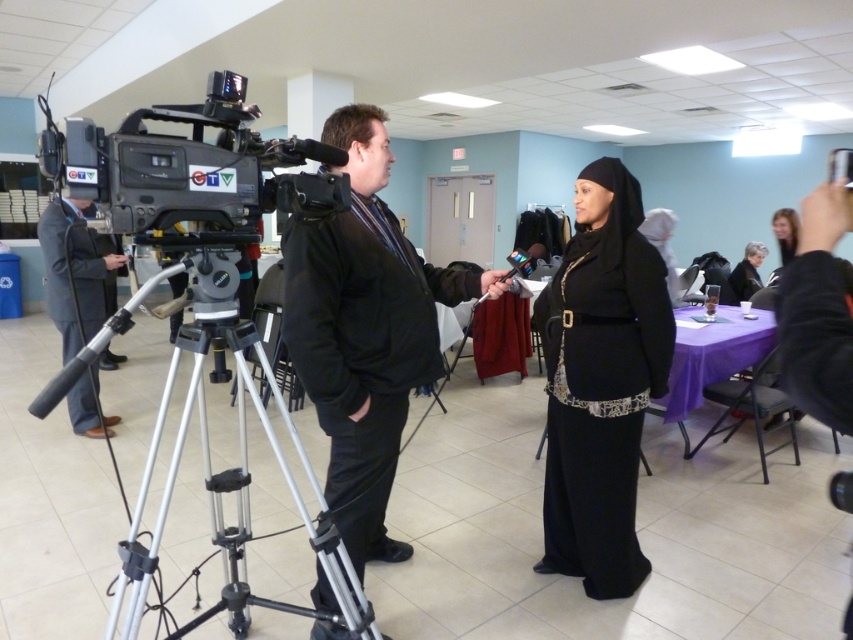
How far apart are black matte jacket at center and black velvet robe at center?

black matte jacket at center and black velvet robe at center are 4.54 meters apart from each other.

Does black matte jacket at center have a smaller size compared to black velvet robe at center?

No.

Measure the distance between point (363, 292) and camera.

Point (363, 292) and camera are 1.93 meters apart.

Identify the location of black matte jacket at center. (364, 330).

Can you confirm if black matte jacket at center is positioned above silver metallic tripod at center?

Yes, black matte jacket at center is above silver metallic tripod at center.

Looking at this image, is black matte jacket at center smaller than silver metallic tripod at center?

No.

What do you see at coordinates (364, 330) in the screenshot? I see `black matte jacket at center` at bounding box center [364, 330].

Locate an element on the screen. black matte jacket at center is located at coordinates (364, 330).

Who is more distant from viewer, [782,220] or [740,296]?

The point [740,296] is more distant.

Is black fabric hijab at upper right to the right of black velvet robe at center from the viewer's perspective?

Indeed, black fabric hijab at upper right is positioned on the right side of black velvet robe at center.

Who is more distant from viewer, (790, 237) or (740, 268)?

The point (740, 268) is behind.

Image resolution: width=853 pixels, height=640 pixels. I want to click on black fabric hijab at upper right, so click(782, 237).